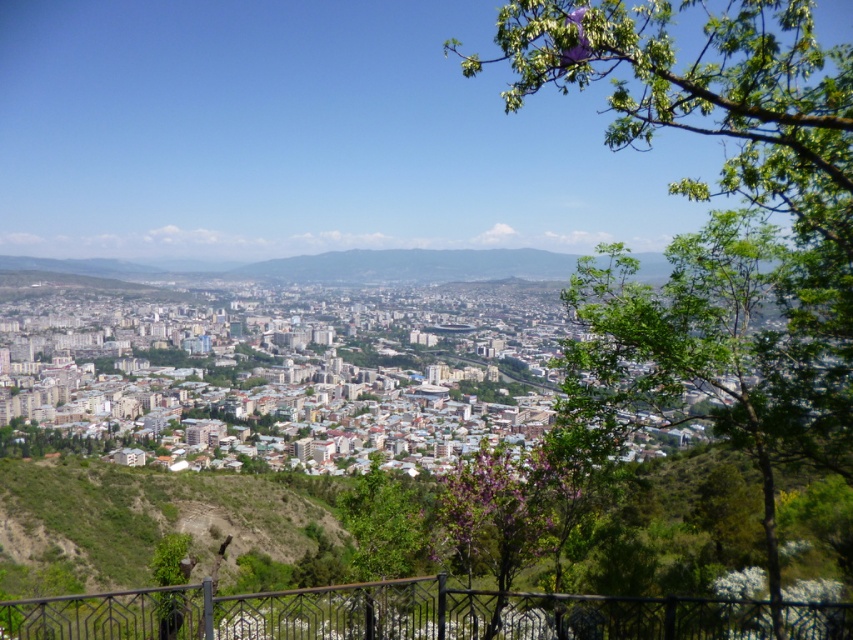
Which is behind, point (392, 516) or point (173, 580)?

Positioned behind is point (392, 516).

Does point (399, 563) lie in front of point (178, 554)?

No, (399, 563) is further to viewer.

The width and height of the screenshot is (853, 640). What are the coordinates of `green leafy tree at center` in the screenshot? It's located at (380, 524).

This screenshot has height=640, width=853. In order to click on green leafy tree at center in this screenshot , I will do `click(380, 524)`.

Locate an element on the screen. Image resolution: width=853 pixels, height=640 pixels. black metal railing at lower center is located at coordinates (410, 614).

Who is more distant from viewer, (759,616) or (503,531)?

Positioned behind is point (503,531).

Where is `black metal railing at lower center`? The height and width of the screenshot is (640, 853). black metal railing at lower center is located at coordinates (410, 614).

Which is more to the left, black metal railing at lower center or green leafy tree at center?

green leafy tree at center

Is point (329, 600) positioned before point (403, 540)?

Yes, point (329, 600) is in front of point (403, 540).

Measure the distance between point (699, 618) and camera.

617.52 meters

You are a GUI agent. You are given a task and a screenshot of the screen. Output one action in this format:
    pyautogui.click(x=<x>, y=<y>)
    Task: Click on the black metal railing at lower center
    
    Given the screenshot: What is the action you would take?
    pyautogui.click(x=410, y=614)